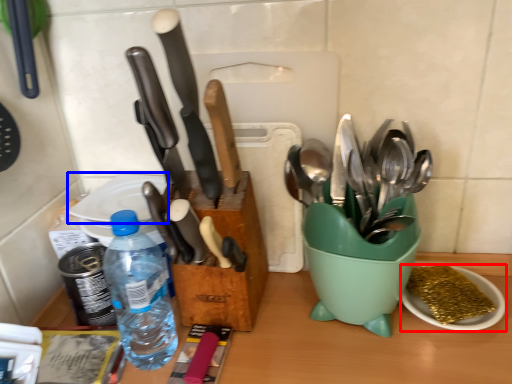
Question: Which object appears closest to the camera in this image, tableware (highlighted by a red box) or plate (highlighted by a blue box)?

Choices:
 (A) tableware
 (B) plate

Answer: (A)